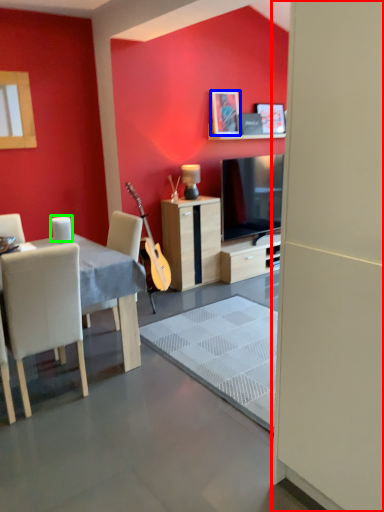
Question: Which is farther away from screen door (highlighted by a red box)? picture frame (highlighted by a blue box) or coffee cup (highlighted by a green box)?

Choices:
 (A) picture frame
 (B) coffee cup

Answer: (A)